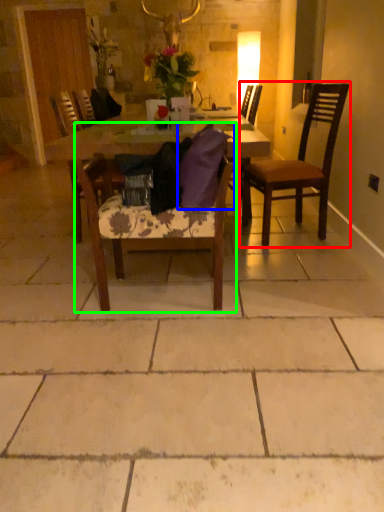
Question: Estimate the real-world distances between objects in this image. Which object is farther from chair (highlighted by a red box), pillow (highlighted by a blue box) or chair (highlighted by a green box)?

Choices:
 (A) pillow
 (B) chair

Answer: (B)